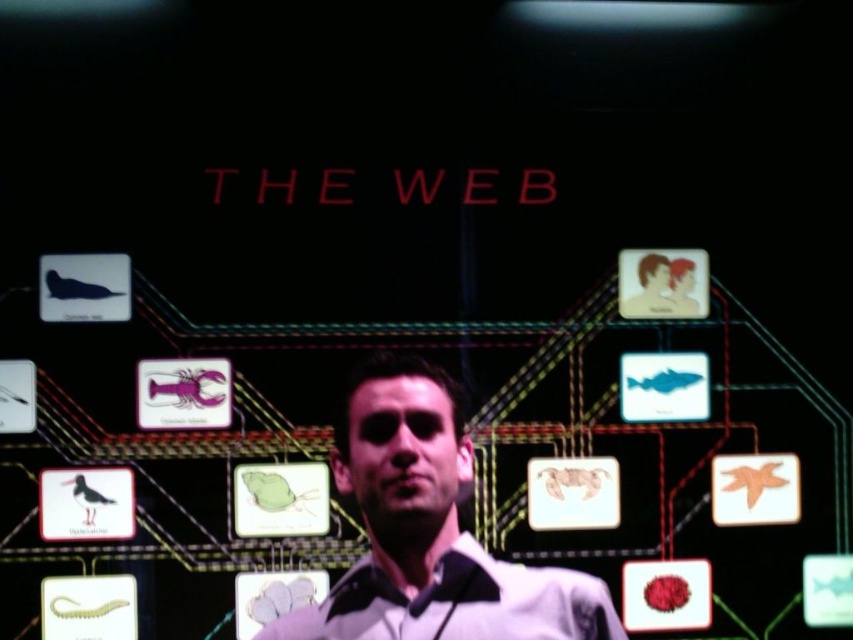
Question: Which point is closer to the camera taking this photo?

Choices:
 (A) (553, 628)
 (B) (473, 573)

Answer: (B)

Question: Does white matte shirt at center appear on the left side of white glossy dress shirt at center?

Choices:
 (A) yes
 (B) no

Answer: (B)

Question: Does white matte shirt at center appear over white glossy dress shirt at center?

Choices:
 (A) no
 (B) yes

Answer: (B)

Question: Is white matte shirt at center below white glossy dress shirt at center?

Choices:
 (A) yes
 (B) no

Answer: (B)